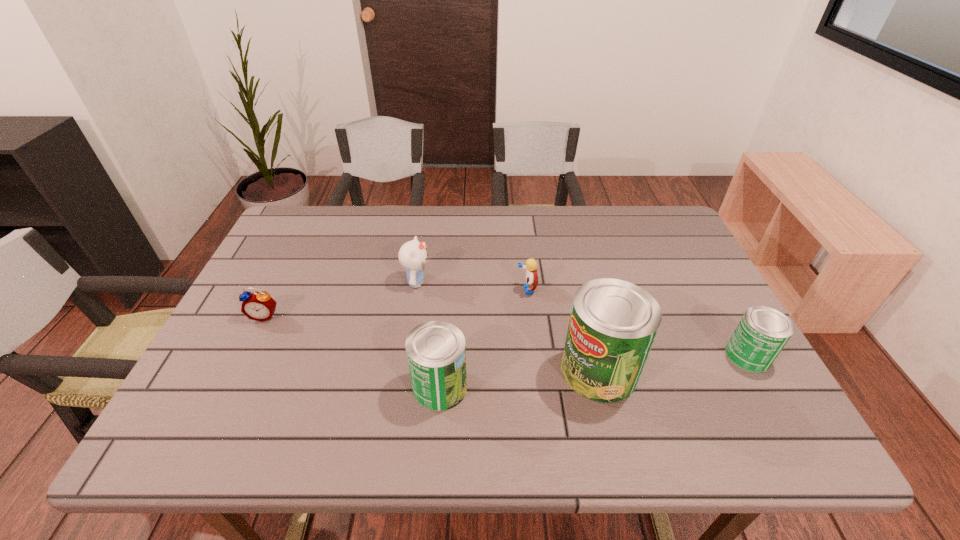
Find the location of a particular element. free space at the near edge of the desktop is located at coordinates (527, 400).

The image size is (960, 540). In order to click on vacant space at the left edge in this screenshot , I will do `click(268, 334)`.

The image size is (960, 540). In the image, there is a desktop. What are the coordinates of `vacant space at the right edge` in the screenshot? It's located at (674, 255).

Where is `vacant space at the far left corner`? The image size is (960, 540). vacant space at the far left corner is located at coordinates (330, 215).

At what (x,y) coordinates should I click in order to perform the action: click on vacant region at the near left corner of the desktop. Please return your answer as a coordinate pair (x, y). This screenshot has height=540, width=960. Looking at the image, I should click on (204, 406).

In the image, there is a desktop. Where is `free space at the near right corner`? Image resolution: width=960 pixels, height=540 pixels. free space at the near right corner is located at coordinates (715, 403).

Where is `free area in between the leftmost can and the third object from right to left`? free area in between the leftmost can and the third object from right to left is located at coordinates (484, 338).

You are a GUI agent. You are given a task and a screenshot of the screen. Output one action in this format:
    pyautogui.click(x=<x>, y=<y>)
    Task: Click on the free space between the leftmost can and the Lego
    The image size is (960, 540).
    Given the screenshot: What is the action you would take?
    pyautogui.click(x=484, y=338)

Locate an element on the screen. unoccupied area between the tallest object and the kitten is located at coordinates (508, 326).

Find the location of a particular element. vacant region between the rightmost object and the leftmost object is located at coordinates tap(506, 336).